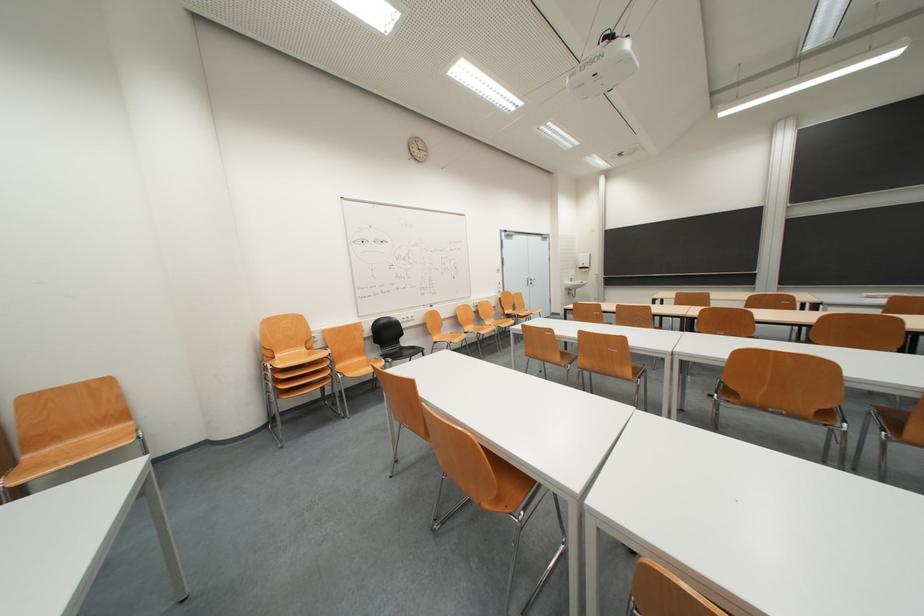
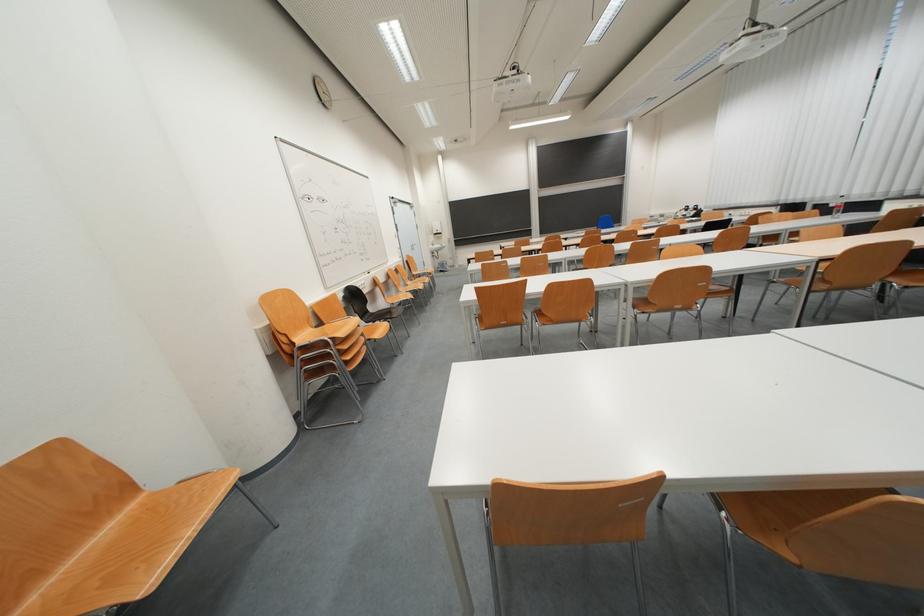
The point at (412, 347) is marked in the first image. Where is the corresponding point in the second image?

(379, 313)